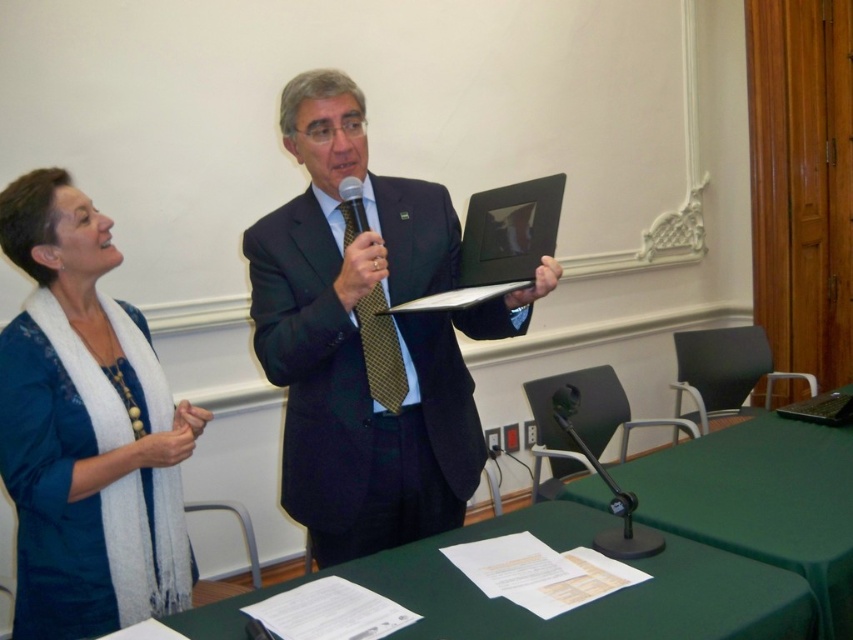
You are an event planner setting up for a presentation. You need to place a decorative centerpiece on the green fabric table at lower center. However, there is a gold textured tie at center that is currently in the way. Can you place the centerpiece on the table without moving the tie?

The green fabric table at lower center is located below the gold textured tie at center, so the tie is above the table. Therefore, you can place the centerpiece on the table without moving the tie since they are at different vertical positions.

You are an attendee at this presentation. You notice two points marked in the room. The first point is at coordinate point (509,614) and the second is at point (393,412). From your perspective as an attendee facing the speakers, which point is closer to the front of the room?

Point (509,614) is in front of point (393,412), so from the attendee facing the speakers, point (509,614) is closer to the front of the room.